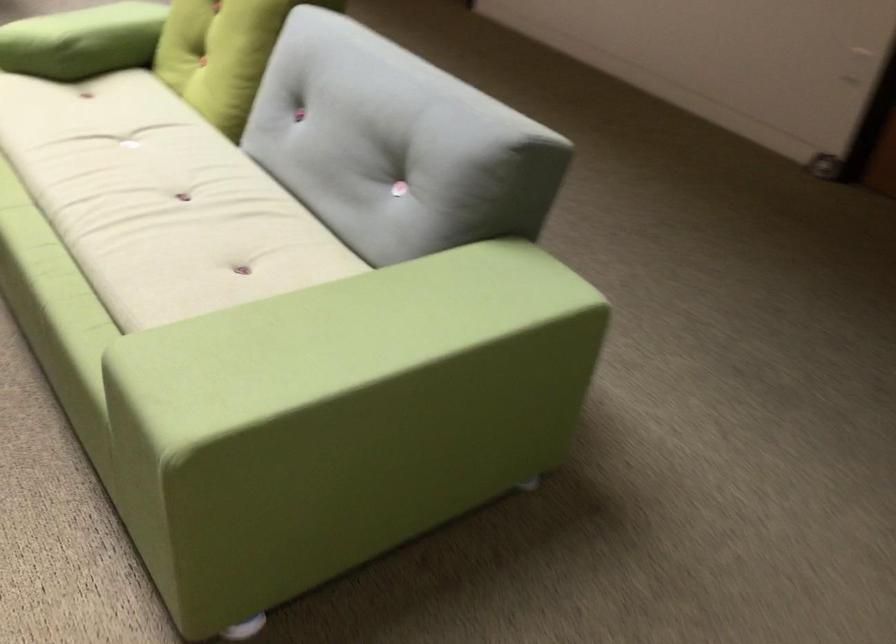
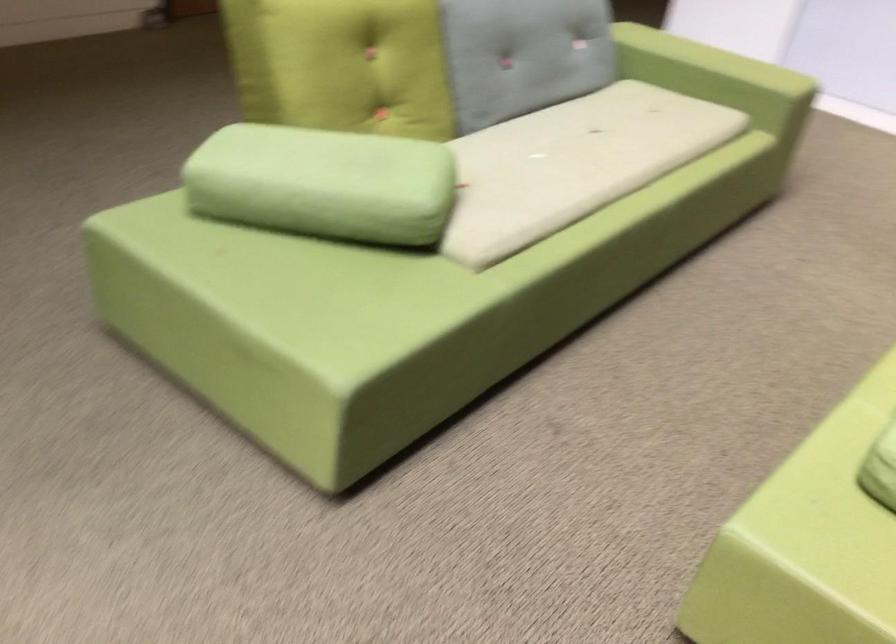
Find the pixel in the second image that matches [73,143] in the first image.

(572, 164)